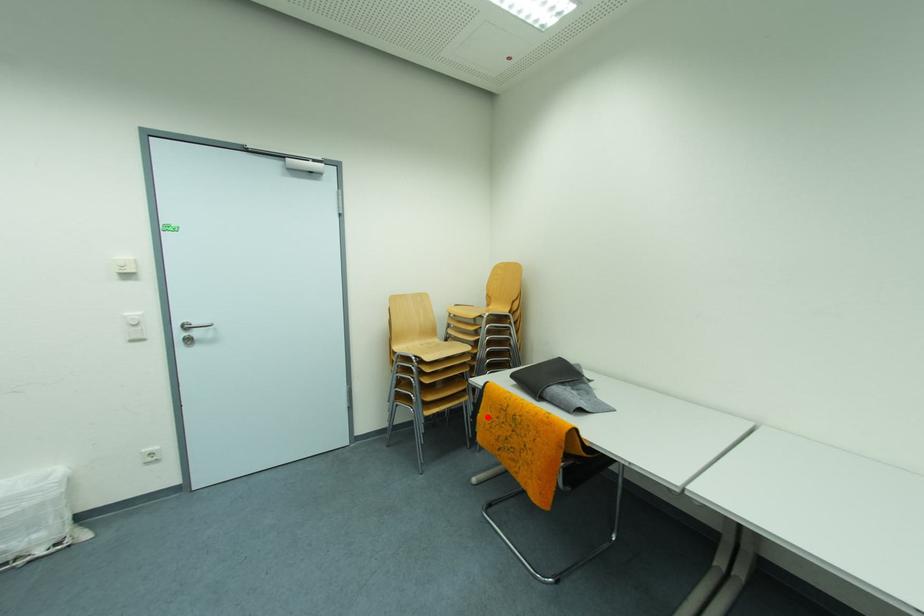
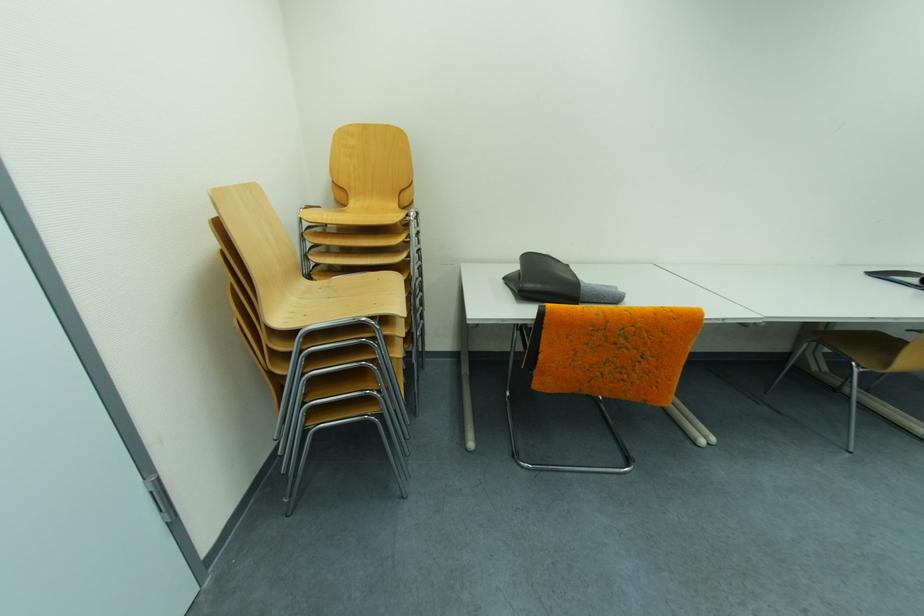
In the second image, find the point that corresponds to the highlighted location in the first image.

(549, 359)